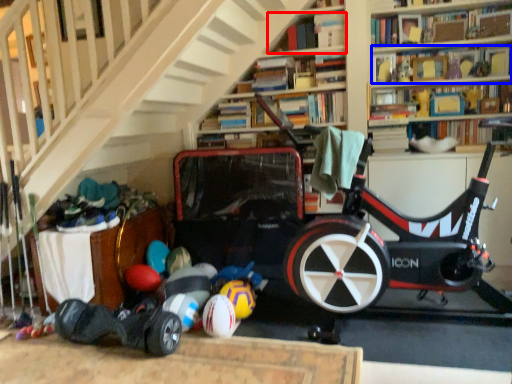
Question: Which of the following is the farthest to the observer, book (highlighted by a red box) or book (highlighted by a blue box)?

Choices:
 (A) book
 (B) book

Answer: (B)